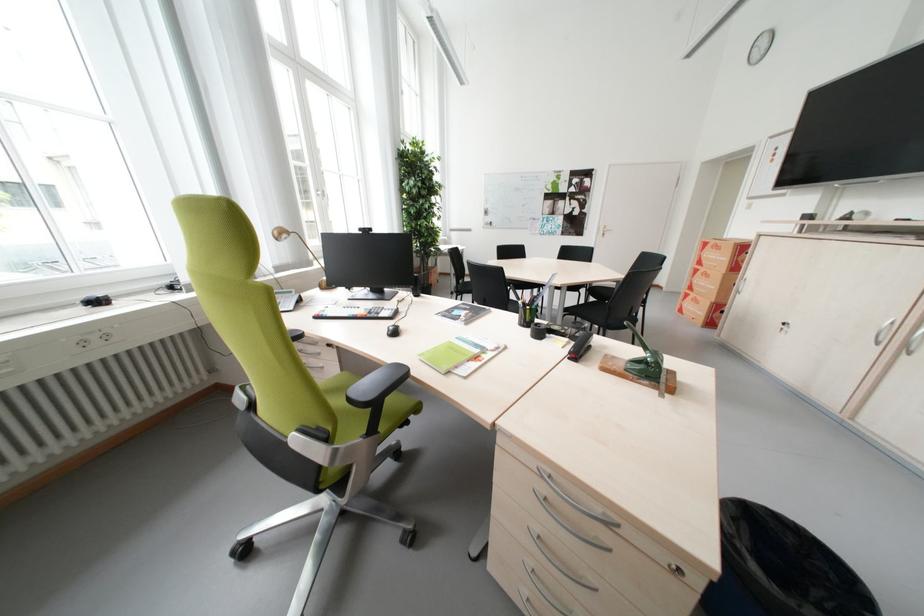
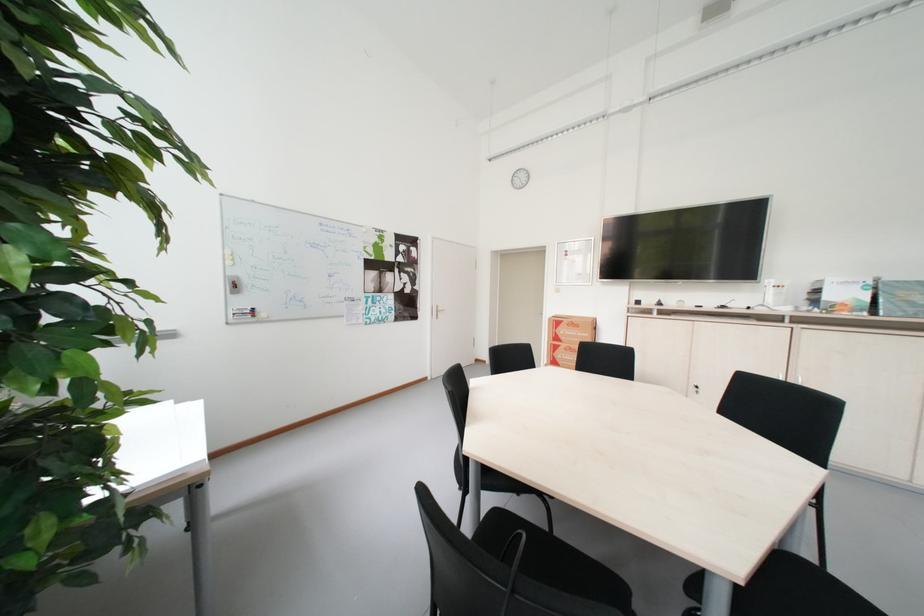
Find the pixel in the second image that matches [602,225] in the first image.

(434, 305)